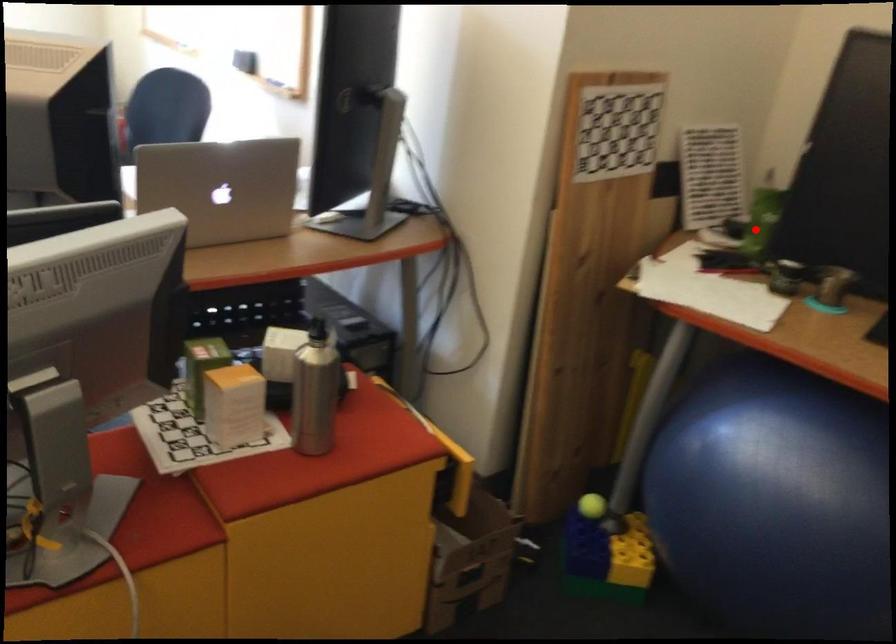
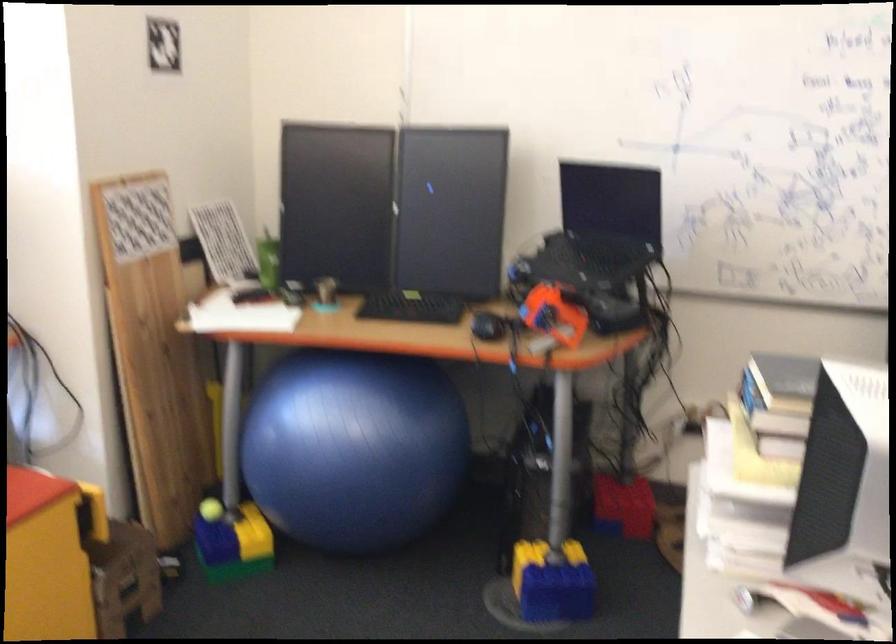
In the second image, find the point that corresponds to the highlighted location in the first image.

(268, 261)